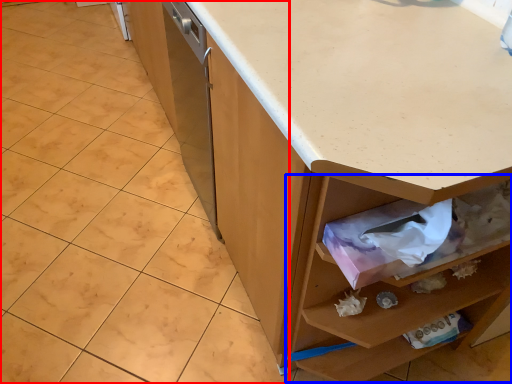
Question: Among these objects, which one is farthest to the camera, granite (highlighted by a red box) or drawer (highlighted by a blue box)?

Choices:
 (A) granite
 (B) drawer

Answer: (A)